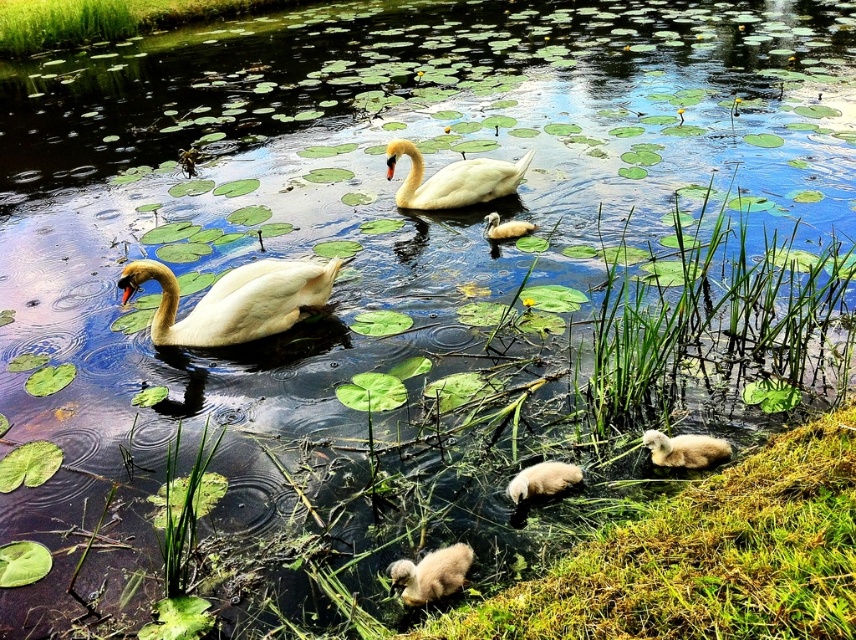
Question: Is white glossy swan at center closer to the viewer compared to fluffy white duckling at lower center?

Choices:
 (A) no
 (B) yes

Answer: (A)

Question: Can you confirm if white glossy swan at center is positioned to the left of fluffy white duckling at lower center?

Choices:
 (A) no
 (B) yes

Answer: (B)

Question: Which object appears farthest from the camera in this image?

Choices:
 (A) white glossy swan at left
 (B) fluffy beige duckling at lower center

Answer: (A)

Question: Which point is farther to the camera?

Choices:
 (A) (421, 576)
 (B) (492, 218)

Answer: (B)

Question: Estimate the real-world distances between objects in this image. Which object is closer to the white glossy swan at center?

Choices:
 (A) white glossy swan at left
 (B) fluffy white duckling at lower center

Answer: (A)

Question: Observing the image, what is the correct spatial positioning of white glossy swan at left in reference to fluffy beige duckling at lower center?

Choices:
 (A) right
 (B) left

Answer: (B)